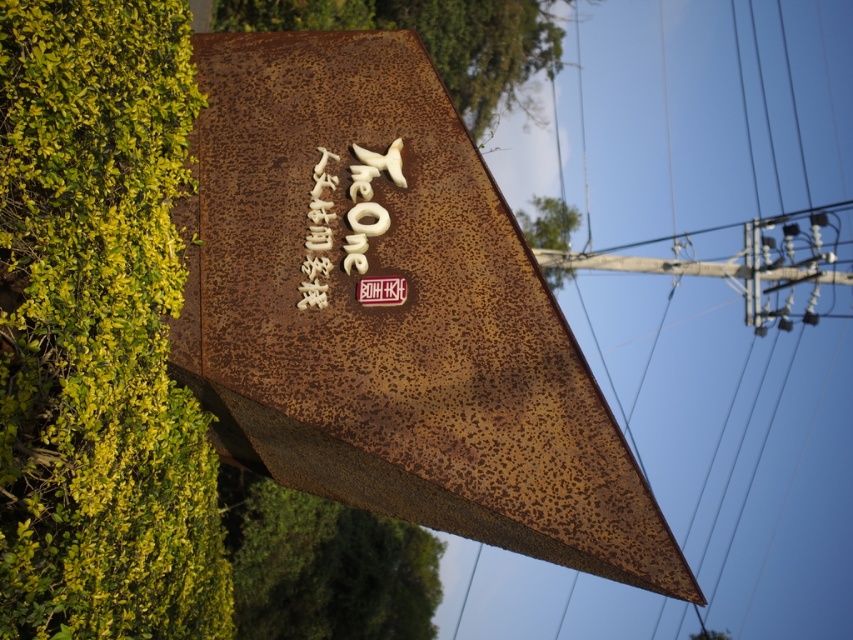
Question: Does rusty metal sign at center have a greater width compared to green leafy hedge at lower left?

Choices:
 (A) no
 (B) yes

Answer: (B)

Question: Estimate the real-world distances between objects in this image. Which object is closer to the green leafy hedge at left?

Choices:
 (A) rusty metal sign at center
 (B) green leafy hedge at lower left

Answer: (A)

Question: Which point appears farthest from the camera in this image?

Choices:
 (A) coord(125,120)
 (B) coord(334,627)
 (C) coord(322,460)

Answer: (B)

Question: Can you confirm if rusty metal sign at center is positioned to the right of green leafy hedge at lower left?

Choices:
 (A) yes
 (B) no

Answer: (A)

Question: From the image, what is the correct spatial relationship of rusty metal sign at center in relation to green leafy hedge at left?

Choices:
 (A) right
 (B) left

Answer: (A)

Question: Which point appears closest to the camera in this image?

Choices:
 (A) (42, 364)
 (B) (424, 618)

Answer: (A)